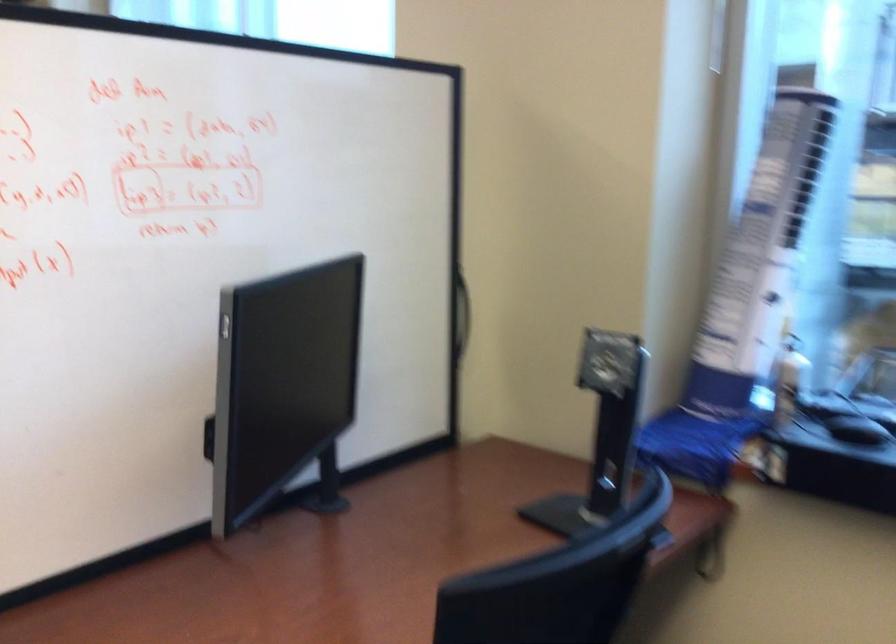
Describe the element at coordinates (461, 313) in the screenshot. I see `the black whiteboard handle` at that location.